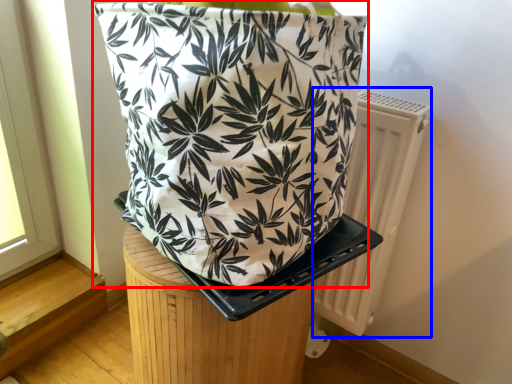
Question: Which point is further to the camera, handbag (highlighted by a red box) or radiator (highlighted by a blue box)?

Choices:
 (A) handbag
 (B) radiator

Answer: (B)